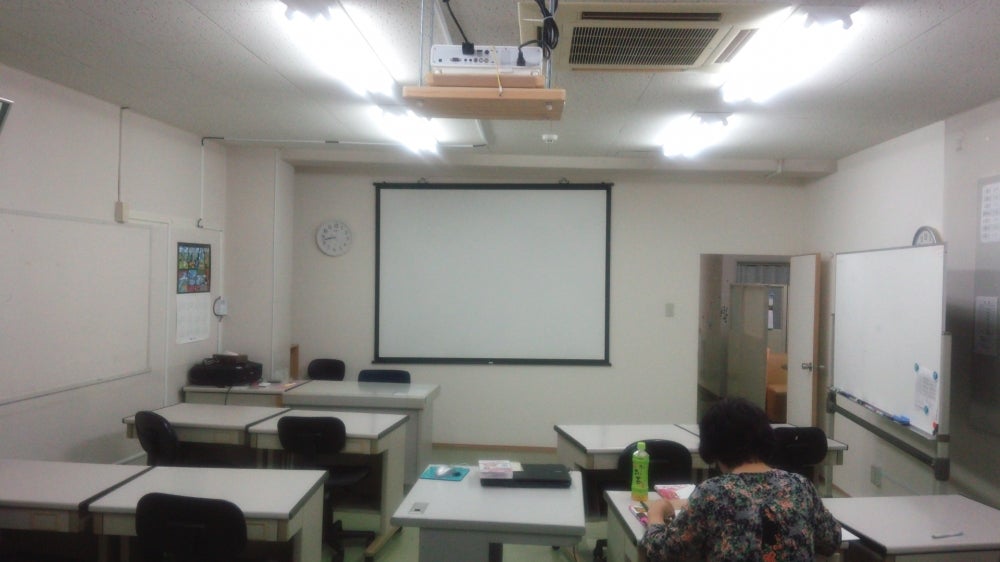
You are a GUI agent. You are given a task and a screenshot of the screen. Output one action in this format:
    pyautogui.click(x=<x>, y=<y>)
    Task: Click on the board
    
    Given the screenshot: What is the action you would take?
    pyautogui.click(x=846, y=301), pyautogui.click(x=854, y=343), pyautogui.click(x=870, y=351), pyautogui.click(x=919, y=307), pyautogui.click(x=908, y=283)